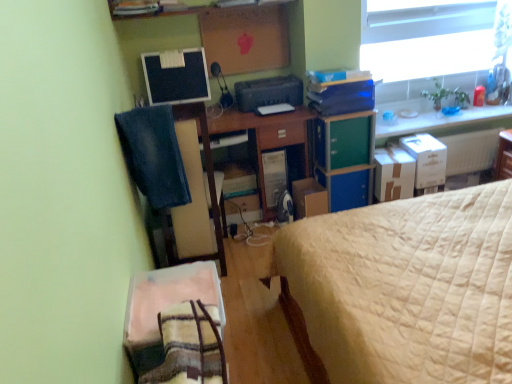
Identify the location of vacant space situated above brown cardboard box at right, which is counted as the 2th cardboard box, starting from the right (from a real-world perspective). The width and height of the screenshot is (512, 384). (392, 156).